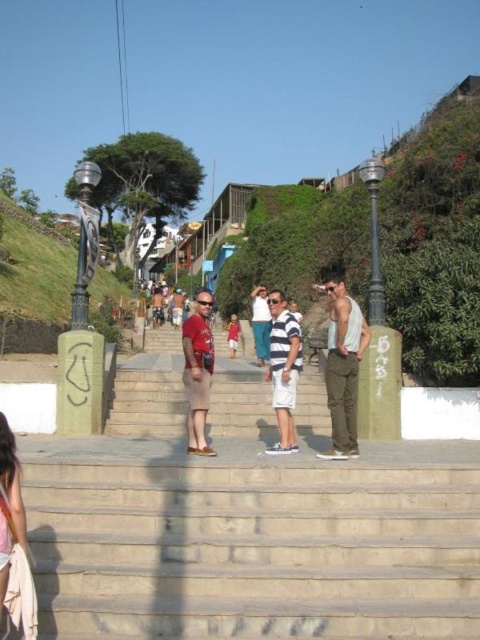
Is point (274, 536) positioned before point (351, 328)?

Yes, it is.

Is point (220, 362) positioned behind point (344, 296)?

Yes.

The image size is (480, 640). Find the location of `concrete stairs at center`. concrete stairs at center is located at coordinates (248, 524).

Is light gray tank top at center wider than matte red shorts at center?

Correct, the width of light gray tank top at center exceeds that of matte red shorts at center.

Is point (340, 426) less distant than point (231, 337)?

That is True.

The height and width of the screenshot is (640, 480). Find the location of `light gray tank top at center`. light gray tank top at center is located at coordinates pos(343,369).

Which is in front, point (345, 381) or point (2, 573)?

Positioned in front is point (2, 573).

Can you confirm if light gray tank top at center is wider than light brown fabric dress at lower left?

Yes, light gray tank top at center is wider than light brown fabric dress at lower left.

Does point (333, 344) come behind point (11, 566)?

Yes, it is.

Find the location of a particular element. light gray tank top at center is located at coordinates (343, 369).